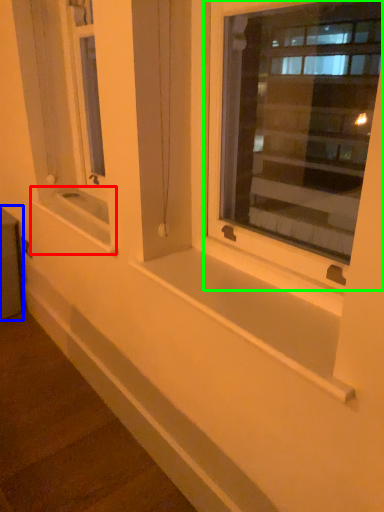
Question: Estimate the real-world distances between objects in this image. Which object is farther from window sill (highlighted by a red box), window box (highlighted by a blue box) or window (highlighted by a green box)?

Choices:
 (A) window box
 (B) window

Answer: (B)